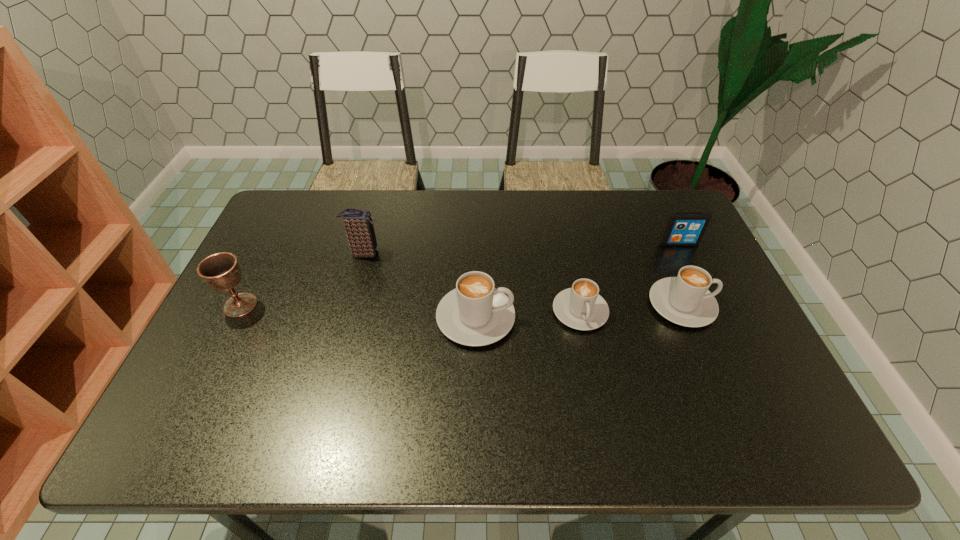
Locate an element on the screen. the fourth object from right to left is located at coordinates (475, 313).

Image resolution: width=960 pixels, height=540 pixels. What are the coordinates of `the shortest object` in the screenshot? It's located at tap(581, 307).

Where is `the second cappuccino from right to left`? The width and height of the screenshot is (960, 540). the second cappuccino from right to left is located at coordinates (581, 307).

Where is `the rightmost cappuccino`? This screenshot has height=540, width=960. the rightmost cappuccino is located at coordinates (685, 300).

In order to click on the leftmost object in this screenshot , I will do `click(221, 271)`.

This screenshot has width=960, height=540. What are the coordinates of `clutch bag` in the screenshot? It's located at (358, 224).

Identify the location of the second object from left to right. Image resolution: width=960 pixels, height=540 pixels. (358, 224).

This screenshot has width=960, height=540. Identify the location of the farthest object. (683, 228).

Locate an element on the screen. free space located 0.280m to the right of the leftmost cappuccino is located at coordinates 619,318.

Locate an element on the screen. The height and width of the screenshot is (540, 960). vacant area situated to the right of the shortest cappuccino is located at coordinates (588, 353).